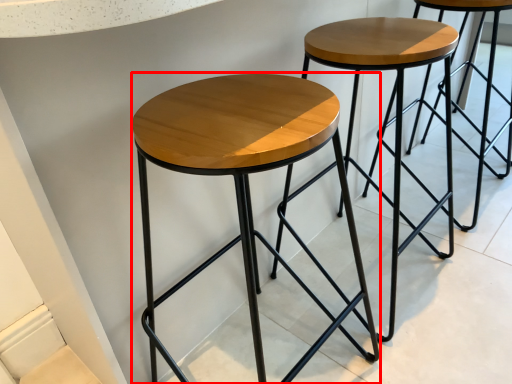
Question: From the image, what is the correct spatial relationship of stool (annotated by the red box) in relation to stool?

Choices:
 (A) right
 (B) left

Answer: (B)